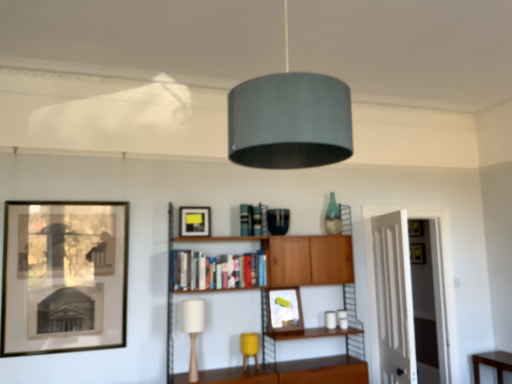
What is the approximate width of white matte table lamp at center, the second table lamp in the back-to-front sequence?

It is 7.82 inches.

Describe the element at coordinates (250, 348) in the screenshot. I see `yellow fabric table lamp at lower center, the 1th table lamp viewed from the back` at that location.

Locate an element on the screen. The width and height of the screenshot is (512, 384). white wood door at right is located at coordinates (438, 264).

What do you see at coordinates (492, 363) in the screenshot? I see `brown wooden table at lower right` at bounding box center [492, 363].

The height and width of the screenshot is (384, 512). What are the coordinates of `white matte table lamp at center, which is the second table lamp from right to left` in the screenshot? It's located at (193, 330).

Is white wood door at right oriented away from wooden cabinet at center?

white wood door at right does not have its back to wooden cabinet at center.

Considering their positions, is white wood door at right located in front of or behind wooden cabinet at center?

Clearly, white wood door at right is behind wooden cabinet at center.

Considering the relative sizes of white wood door at right and wooden cabinet at center in the image provided, is white wood door at right shorter than wooden cabinet at center?

In fact, white wood door at right may be taller than wooden cabinet at center.

From the image's perspective, which is above, white matte table lamp at center, the second table lamp in the back-to-front sequence, or hardcover books at center?

hardcover books at center, from the image's perspective.

Considering the sizes of objects white matte table lamp at center, which is the second table lamp from right to left, and hardcover books at center in the image provided, who is thinner, white matte table lamp at center, which is the second table lamp from right to left, or hardcover books at center?

With smaller width is white matte table lamp at center, which is the second table lamp from right to left.

Considering the relative sizes of white matte table lamp at center, which is the 1th table lamp from left to right, and hardcover books at center in the image provided, is white matte table lamp at center, which is the 1th table lamp from left to right, bigger than hardcover books at center?

No, white matte table lamp at center, which is the 1th table lamp from left to right, is not bigger than hardcover books at center.

Consider the image. Considering the positions of objects white matte table lamp at center, which is the 1th table lamp from left to right, and hardcover books at center in the image provided, who is more to the left, white matte table lamp at center, which is the 1th table lamp from left to right, or hardcover books at center?

white matte table lamp at center, which is the 1th table lamp from left to right, is more to the left.

From a real-world perspective, who is located lower, matte black picture frame at left, the third picture frame positioned from the right, or white matte table lamp at center, the second table lamp in the back-to-front sequence?

From a 3D spatial view, white matte table lamp at center, the second table lamp in the back-to-front sequence, is below.

Considering the relative positions of matte black picture frame at left, which is the 3th picture frame in back-to-front order, and white matte table lamp at center, which is the 1th table lamp from left to right, in the image provided, is matte black picture frame at left, which is the 3th picture frame in back-to-front order, to the right of white matte table lamp at center, which is the 1th table lamp from left to right, from the viewer's perspective?

No.

In the scene shown: Would you consider matte black picture frame at left, which ranks as the 1th picture frame in front-to-back order, to be distant from white matte table lamp at center, which is the 1th table lamp from left to right?

No, matte black picture frame at left, which ranks as the 1th picture frame in front-to-back order, is not far from white matte table lamp at center, which is the 1th table lamp from left to right.

Is matte black picture frame at upper center, marked as the 2th picture frame in a right-to-left arrangement, positioned beyond the bounds of yellow fabric table lamp at lower center, the 1th table lamp from the right?

Absolutely, matte black picture frame at upper center, marked as the 2th picture frame in a right-to-left arrangement, is external to yellow fabric table lamp at lower center, the 1th table lamp from the right.

How many degrees apart are the facing directions of matte black picture frame at upper center, which ranks as the second picture frame in front-to-back order, and yellow fabric table lamp at lower center, the 1th table lamp viewed from the back?

4.9 degrees separate the facing orientations of matte black picture frame at upper center, which ranks as the second picture frame in front-to-back order, and yellow fabric table lamp at lower center, the 1th table lamp viewed from the back.

Is matte black picture frame at upper center, which is the 2th picture frame in back-to-front order, facing towards yellow fabric table lamp at lower center, the 1th table lamp from the right?

No, matte black picture frame at upper center, which is the 2th picture frame in back-to-front order, does not turn towards yellow fabric table lamp at lower center, the 1th table lamp from the right.

Considering their positions, is yellow fabric table lamp at lower center, the 1th table lamp from the right, located in front of or behind wooden cabinet at center?

yellow fabric table lamp at lower center, the 1th table lamp from the right, is behind wooden cabinet at center.

Considering the sizes of objects yellow fabric table lamp at lower center, the 2th table lamp positioned from the front, and wooden cabinet at center in the image provided, who is smaller, yellow fabric table lamp at lower center, the 2th table lamp positioned from the front, or wooden cabinet at center?

yellow fabric table lamp at lower center, the 2th table lamp positioned from the front.

From the image's perspective, which is below, yellow fabric table lamp at lower center, the 1th table lamp from the right, or wooden cabinet at center?

yellow fabric table lamp at lower center, the 1th table lamp from the right, from the image's perspective.

Is yellow fabric table lamp at lower center, marked as the 2th table lamp in a left-to-right arrangement, to the right of wooden cabinet at center from the viewer's perspective?

No.

The height and width of the screenshot is (384, 512). What are the coordinates of `table lamp that is the 2nd object directly below the white wood door at right (from a real-world perspective)` in the screenshot? It's located at (250, 348).

Between white wood door at right and yellow fabric table lamp at lower center, the 2th table lamp positioned from the front, which one has smaller width?

With smaller width is yellow fabric table lamp at lower center, the 2th table lamp positioned from the front.

Which of these two, white wood door at right or yellow fabric table lamp at lower center, the 2th table lamp positioned from the front, stands taller?

Standing taller between the two is white wood door at right.

Are white wood door at right and yellow fabric table lamp at lower center, the 1th table lamp viewed from the back, located far from each other?

Absolutely, white wood door at right is distant from yellow fabric table lamp at lower center, the 1th table lamp viewed from the back.

At what (x,y) coordinates should I click in order to perform the action: click on the 1st picture frame in front of the brown wooden table at lower right, starting your count from the anchor. Please return your answer as a coordinate pair (x, y). This screenshot has width=512, height=384. Looking at the image, I should click on (284, 309).

Is brown wooden table at lower right looking in the opposite direction of matte silver picture frame at center, positioned as the 1th picture frame in right-to-left order?

That's not correct — brown wooden table at lower right is not looking away from matte silver picture frame at center, positioned as the 1th picture frame in right-to-left order.

Which of these two, brown wooden table at lower right or matte silver picture frame at center, which ranks as the third picture frame in left-to-right order, stands shorter?

Standing shorter between the two is brown wooden table at lower right.

Is matte silver picture frame at center, arranged as the 3th picture frame when viewed from the front, located within brown wooden table at lower right?

No, matte silver picture frame at center, arranged as the 3th picture frame when viewed from the front, is not surrounded by brown wooden table at lower right.

You are a GUI agent. You are given a task and a screenshot of the screen. Output one action in this format:
    pyautogui.click(x=<x>, y=<y>)
    Task: Click on the shelf on the left side of white wood door at right
    The image size is (512, 384).
    Given the screenshot: What is the action you would take?
    pyautogui.click(x=298, y=361)

Locate an element on the screen. book on the right of white matte table lamp at center, marked as the first table lamp in a front-to-back arrangement is located at coordinates (218, 271).

From the picture: Based on their spatial positions, is yellow fabric table lamp at lower center, marked as the 2th table lamp in a left-to-right arrangement, or white matte table lamp at center, which is the 1th table lamp from left to right, further from hardcover books at center?

yellow fabric table lamp at lower center, marked as the 2th table lamp in a left-to-right arrangement, is further to hardcover books at center.

Estimate the real-world distances between objects in this image. Which object is further from brown wooden table at lower right, white wood door at right or wooden cabinet at center?

Among the two, wooden cabinet at center is located further to brown wooden table at lower right.

Consider the image. Considering their positions, is brown wooden table at lower right positioned further to matte silver picture frame at center, arranged as the 3th picture frame when viewed from the front, than hardcover books at center?

brown wooden table at lower right is positioned further to the anchor matte silver picture frame at center, arranged as the 3th picture frame when viewed from the front.

Which object lies further to the anchor point matte silver picture frame at center, positioned as the 1th picture frame in right-to-left order, wooden cabinet at center or hardcover books at center?

Among the two, hardcover books at center is located further to matte silver picture frame at center, positioned as the 1th picture frame in right-to-left order.

Which object lies nearer to the anchor point white wood door at right, hardcover books at center or matte silver picture frame at center, arranged as the 3th picture frame when viewed from the front?

matte silver picture frame at center, arranged as the 3th picture frame when viewed from the front, is closer to white wood door at right.

Based on their spatial positions, is white matte table lamp at center, which is the second table lamp from right to left, or matte black picture frame at upper center, which ranks as the second picture frame in front-to-back order, further from brown wooden table at lower right?

matte black picture frame at upper center, which ranks as the second picture frame in front-to-back order.

Which object lies nearer to the anchor point wooden cabinet at center, matte black picture frame at upper center, marked as the 2th picture frame in a right-to-left arrangement, or hardcover books at center?

Among the two, hardcover books at center is located nearer to wooden cabinet at center.

Looking at the image, which one is located closer to hardcover books at center, matte black picture frame at left, the third picture frame positioned from the right, or white wood door at right?

The object closer to hardcover books at center is matte black picture frame at left, the third picture frame positioned from the right.

Find the location of `book between matte black picture frame at left, which is the 1th picture frame from left to right, and white wood door at right, in the horizontal direction`. book between matte black picture frame at left, which is the 1th picture frame from left to right, and white wood door at right, in the horizontal direction is located at coordinates (218, 271).

The height and width of the screenshot is (384, 512). Find the location of `picture frame between matte black picture frame at upper center, marked as the 2th picture frame in a right-to-left arrangement, and white wood door at right from left to right`. picture frame between matte black picture frame at upper center, marked as the 2th picture frame in a right-to-left arrangement, and white wood door at right from left to right is located at coordinates (284, 309).

The height and width of the screenshot is (384, 512). I want to click on shelf between matte black picture frame at upper center, which ranks as the second picture frame in front-to-back order, and matte silver picture frame at center, positioned as the 1th picture frame in right-to-left order, vertically, so click(298, 361).

Locate an element on the screen. The height and width of the screenshot is (384, 512). table lamp located between matte black picture frame at left, the third picture frame positioned from the right, and hardcover books at center in the left-right direction is located at coordinates (193, 330).